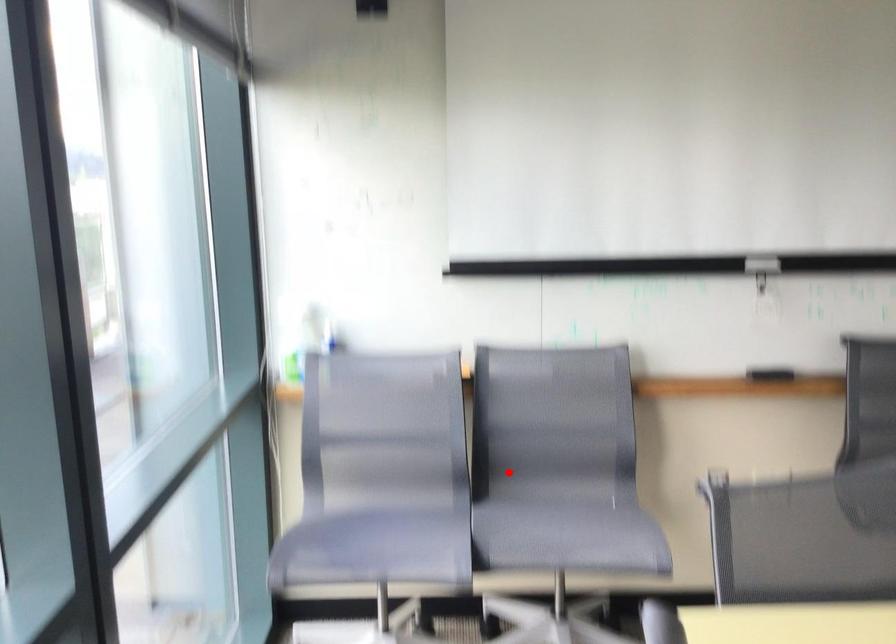
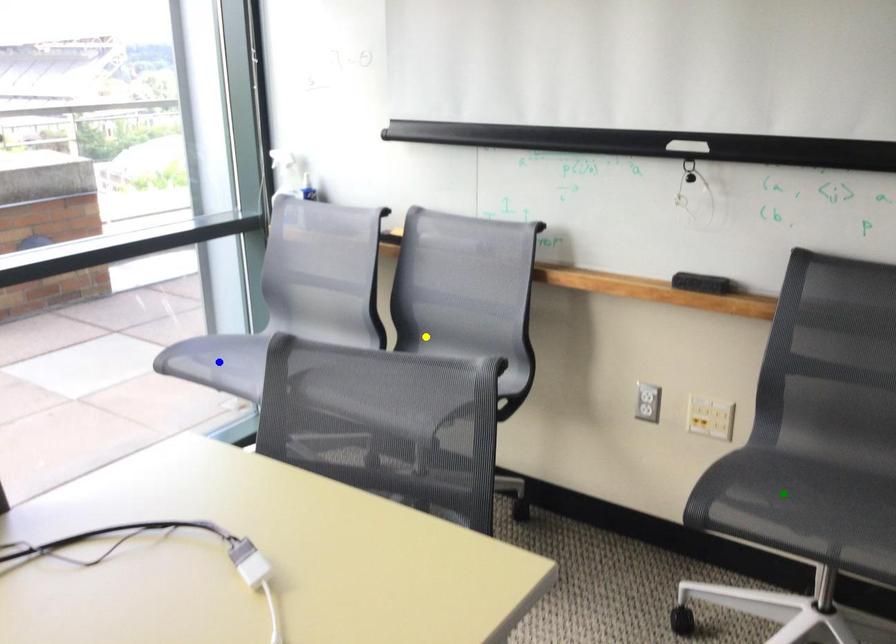
Question: I am providing you with two images of the same scene from different viewpoints. A red point is marked on the first image. You are given multiple points on the second image. Which point in image 2 represents the same 3d spot as the red point in image 1?

Choices:
 (A) green point
 (B) yellow point
 (C) blue point

Answer: (B)